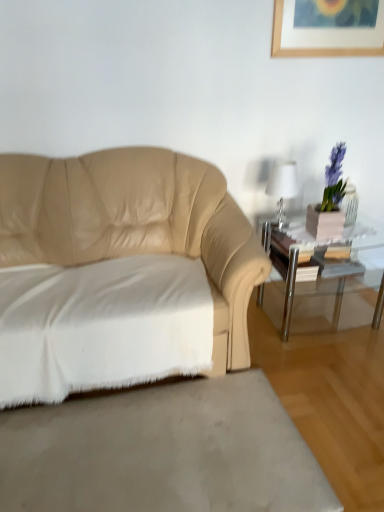
Question: Should I look upward or downward to see beige leather couch at left?

Choices:
 (A) down
 (B) up

Answer: (A)

Question: Is white cotton sheet at lower left positioned beyond the bounds of clear glass table at right?

Choices:
 (A) yes
 (B) no

Answer: (A)

Question: Is white cotton sheet at lower left far from clear glass table at right?

Choices:
 (A) no
 (B) yes

Answer: (A)

Question: Does white cotton sheet at lower left have a smaller size compared to clear glass table at right?

Choices:
 (A) yes
 (B) no

Answer: (B)

Question: Is white cotton sheet at lower left closer to the viewer compared to clear glass table at right?

Choices:
 (A) yes
 (B) no

Answer: (A)

Question: Is white cotton sheet at lower left bigger than clear glass table at right?

Choices:
 (A) no
 (B) yes

Answer: (B)

Question: Can you confirm if white cotton sheet at lower left is positioned to the left of clear glass table at right?

Choices:
 (A) no
 (B) yes

Answer: (B)

Question: Is clear glass table at right oriented away from white cotton sheet at lower left?

Choices:
 (A) yes
 (B) no

Answer: (B)

Question: Does clear glass table at right turn towards white cotton sheet at lower left?

Choices:
 (A) no
 (B) yes

Answer: (A)

Question: From a real-world perspective, is clear glass table at right on white cotton sheet at lower left?

Choices:
 (A) yes
 (B) no

Answer: (B)

Question: Does clear glass table at right come behind white cotton sheet at lower left?

Choices:
 (A) yes
 (B) no

Answer: (A)

Question: Is clear glass table at right wider than white cotton sheet at lower left?

Choices:
 (A) yes
 (B) no

Answer: (B)

Question: Is white cotton sheet at lower left inside clear glass table at right?

Choices:
 (A) no
 (B) yes

Answer: (A)

Question: From a real-world perspective, does clear glass table at right sit lower than white soft rug at lower left?

Choices:
 (A) yes
 (B) no

Answer: (B)